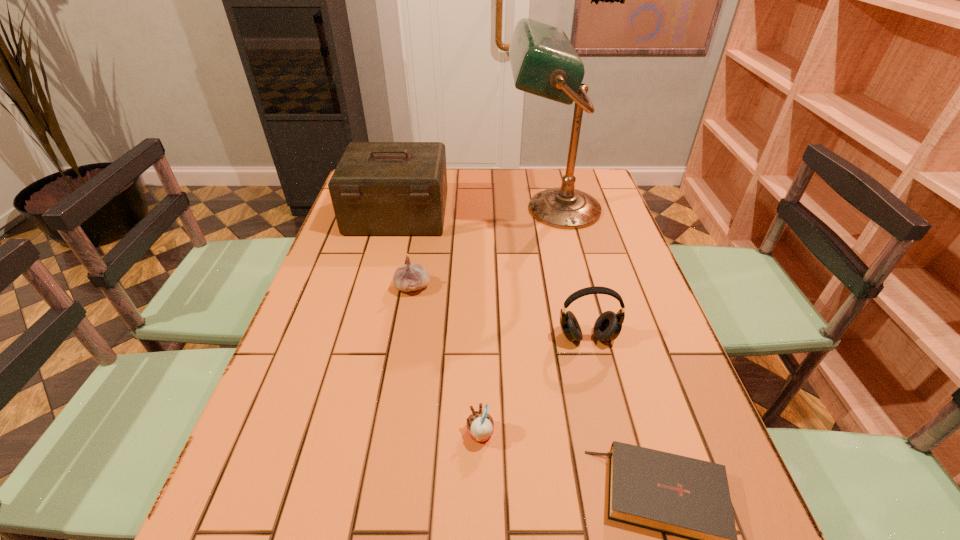
Locate an element on the screen. table lamp is located at coordinates (544, 62).

The height and width of the screenshot is (540, 960). Find the location of `the first-aid kit`. the first-aid kit is located at coordinates (378, 188).

In order to click on the fourth shortest object in this screenshot , I will do `click(608, 325)`.

Find the location of a particular element. This screenshot has height=540, width=960. the third nearest object is located at coordinates (608, 325).

At what (x,y) coordinates should I click in order to perform the action: click on the third shortest object. Please return your answer as a coordinate pair (x, y). This screenshot has height=540, width=960. Looking at the image, I should click on (410, 277).

The width and height of the screenshot is (960, 540). I want to click on garlic, so click(x=410, y=277).

Find the location of a particular element. Image resolution: width=960 pixels, height=540 pixels. muffin is located at coordinates (480, 426).

Locate an element on the screen. This screenshot has width=960, height=540. the third object from left to right is located at coordinates (480, 426).

In order to click on vacant region located 0.190m above the green lampshade of the tallest object in this screenshot , I will do `click(448, 209)`.

Where is `vacant region located above the green lampshade of the tallest object`? The height and width of the screenshot is (540, 960). vacant region located above the green lampshade of the tallest object is located at coordinates (433, 209).